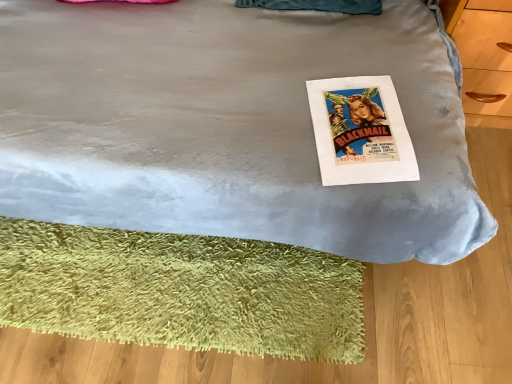
Locate an element on the screen. Image resolution: width=512 pixels, height=384 pixels. free space above white paper at center (from a real-world perspective) is located at coordinates point(359,122).